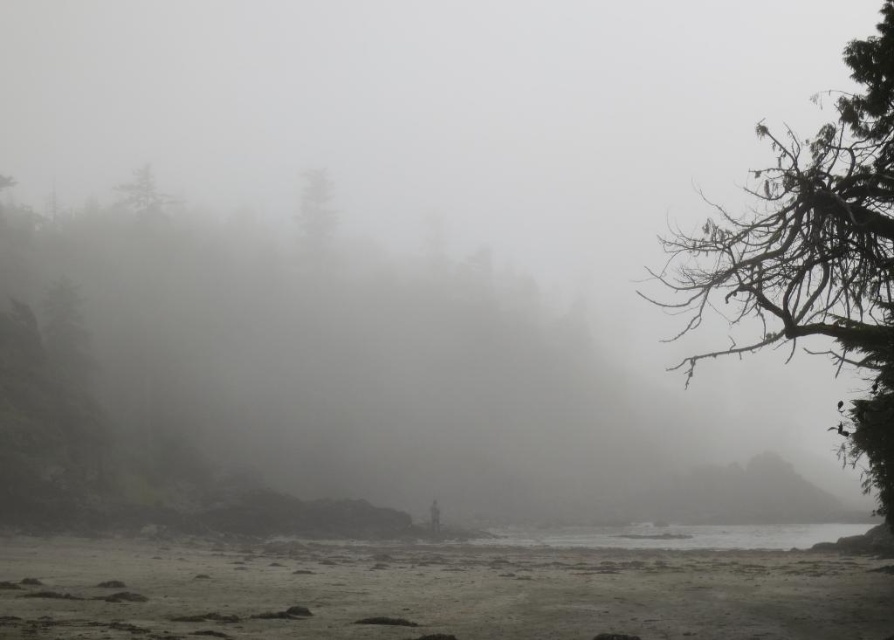
Question: From the image, what is the correct spatial relationship of gray sand shoreline at lower center in relation to dark green textured tree at right?

Choices:
 (A) above
 (B) below

Answer: (B)

Question: Does gray sand shoreline at lower center have a larger size compared to green matte tree at center?

Choices:
 (A) no
 (B) yes

Answer: (B)

Question: Estimate the real-world distances between objects in this image. Which object is farther from the gray sand shoreline at lower center?

Choices:
 (A) clear water at lower center
 (B) dark green textured tree at right

Answer: (B)

Question: Considering the real-world distances, which object is farthest from the green matte tree at center?

Choices:
 (A) gray sand shoreline at lower center
 (B) clear water at lower center
 (C) dark green textured tree at right

Answer: (C)

Question: Considering the real-world distances, which object is farthest from the gray sand shoreline at lower center?

Choices:
 (A) green matte tree at center
 (B) dark green textured tree at right

Answer: (A)

Question: Does gray sand shoreline at lower center have a greater width compared to clear water at lower center?

Choices:
 (A) yes
 (B) no

Answer: (A)